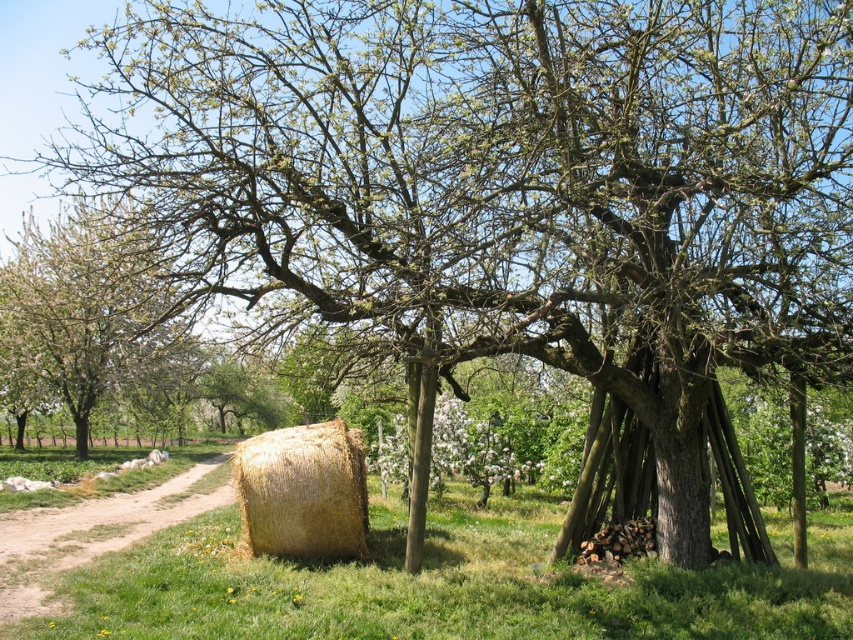
You are a hiker standing at the brown dirt track at lower left, looking towards the white blossoming tree at center. Which direction should you walk to reach the tree?

The white blossoming tree at center is above the brown dirt track at lower left, so you should walk upwards or towards the center to reach it.

You are standing at the point marked by coordinates point [80,308] in the image. Looking around, you see a large tree with a thick trunk and sprawling branches. Which object in the scene is directly above you?

The point [80,308] is on the white blossoming tree at center, so the white blossoming tree at center is directly above you.